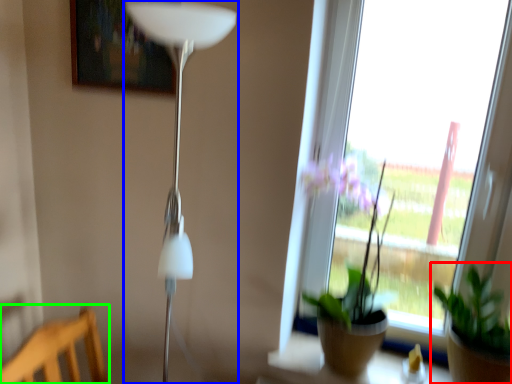
Question: Considering the real-world distances, which object is closest to houseplant (highlighted by a red box)? lamp (highlighted by a blue box) or furniture (highlighted by a green box).

Choices:
 (A) lamp
 (B) furniture

Answer: (A)